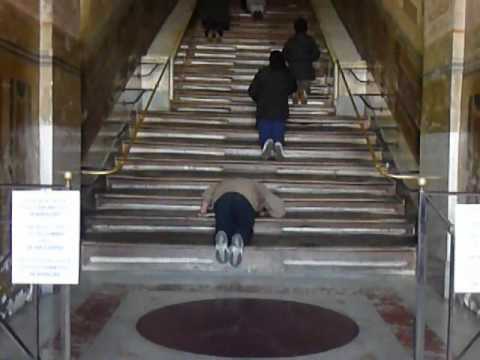
The height and width of the screenshot is (360, 480). I want to click on hand rails, so click(x=107, y=170), click(x=363, y=130).